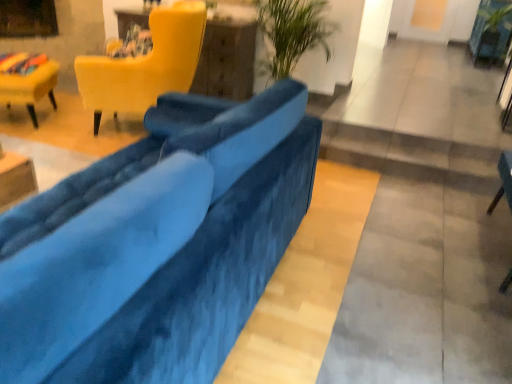
Question: From the image's perspective, is velvet yellow chair at upper left, which is the 2th chair in left-to-right order, above or below velvet yellow chair at left, arranged as the 1th chair when viewed from the left?

Choices:
 (A) above
 (B) below

Answer: (A)

Question: From a real-world perspective, is velvet yellow chair at upper left, which is the second chair from right to left, above or below velvet yellow chair at left, arranged as the third chair when viewed from the right?

Choices:
 (A) above
 (B) below

Answer: (A)

Question: Which is nearer to the matte yellow chair at upper left?

Choices:
 (A) velvet yellow chair at upper left, which is the 2th chair in left-to-right order
 (B) velvet blue couch at center
 (C) green leafy plant at upper right
 (D) velvet blue chair at lower right, acting as the third chair starting from the left
 (E) velvet yellow chair at left, arranged as the 1th chair when viewed from the left

Answer: (A)

Question: Estimate the real-world distances between objects in this image. Which object is farther from the velvet yellow chair at left, arranged as the third chair when viewed from the right?

Choices:
 (A) velvet blue couch at center
 (B) matte yellow chair at upper left
 (C) velvet blue chair at lower right, acting as the first chair starting from the right
 (D) velvet yellow chair at upper left, which is the 2th chair in left-to-right order
 (E) green leafy plant at upper right

Answer: (E)